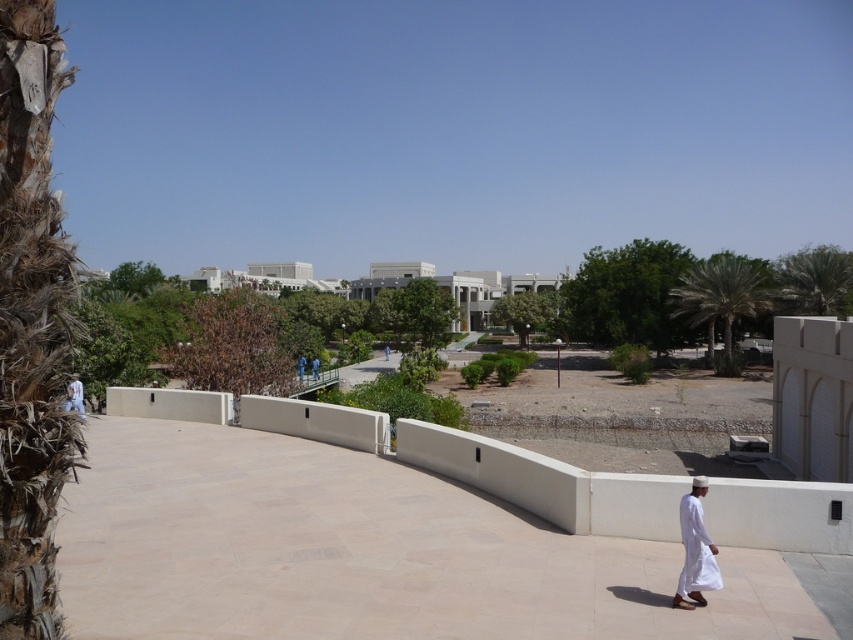
You are standing at the center of the paved area and want to place a small potted plant exactly where the white smooth ledge at center is located. Can you confirm the exact coordinates where you should place it?

The white smooth ledge at center is located at coordinates point (547,483), so place the potted plant there.

You are standing at the entrance of the building complex and notice the white smooth ledge at center and the white cotton robe at lower left in the distance. Which object is positioned lower in the image?

The white smooth ledge at center is located below the white cotton robe at lower left, so it is positioned lower in the image.